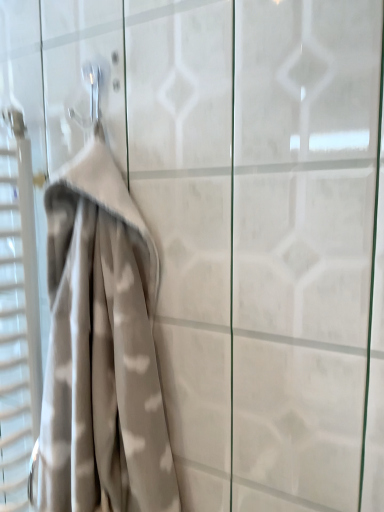
This screenshot has height=512, width=384. What do you see at coordinates (93, 90) in the screenshot? I see `polished chrome hook at upper left` at bounding box center [93, 90].

Locate an element on the screen. The width and height of the screenshot is (384, 512). polished chrome hook at upper left is located at coordinates (93, 90).

You are a GUI agent. You are given a task and a screenshot of the screen. Output one action in this format:
    pyautogui.click(x=<x>, y=<y>)
    Task: Click on the polished chrome hook at upper left
    
    Given the screenshot: What is the action you would take?
    pyautogui.click(x=93, y=90)